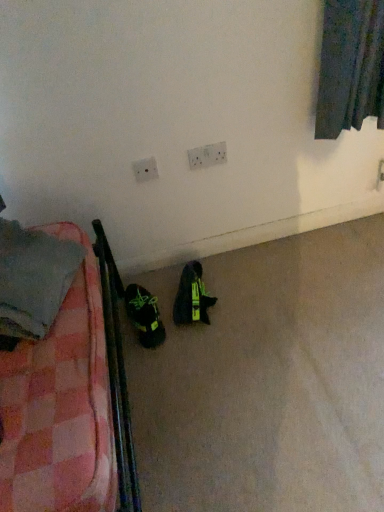
I want to click on vacant space underneath green matte sneakers at lower left, positioned as the first footwear in left-to-right order (from a real-world perspective), so click(x=138, y=332).